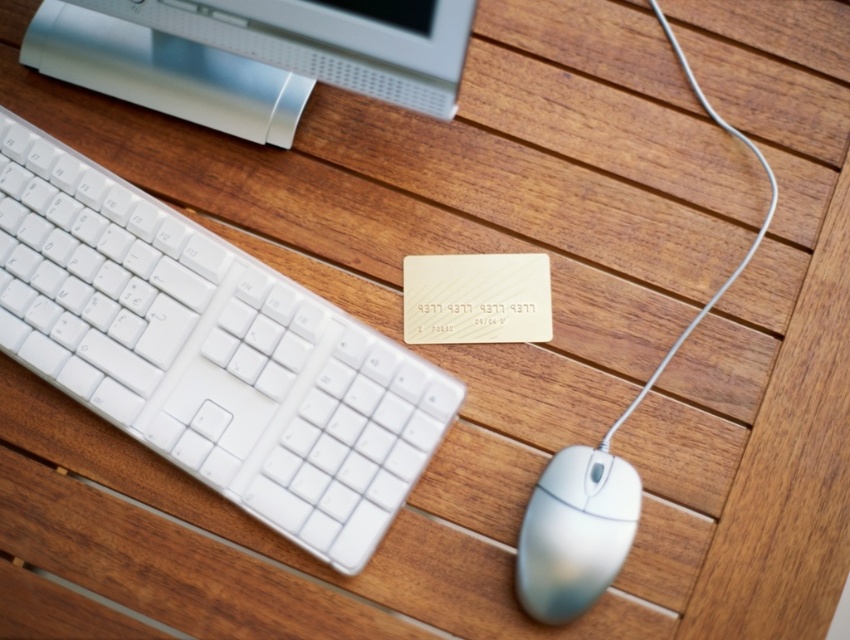
You are organizing a desk and need to place the white plastic keyboard at upper left and the white plastic mouse at lower right. Given their sizes, which one requires more desk space?

The white plastic keyboard at upper left requires more desk space because it is larger in size than the white plastic mouse at lower right.

From the picture: You are setting up a new monitor on your desk and want to place it so that it doesn not block the white plastic keyboard at upper left. Based on the coordinates provided, where should you position the monitor relative to the keyboard?

The white plastic keyboard at upper left is located at coordinates point (208, 353). To avoid blocking it, the monitor should be placed either to the right or above the keyboard, ensuring that the monitor does not overlap with the keyboard at those coordinates.

You are setting up a new desk and need to place the white plastic keyboard at upper left and the satin silver monitor at upper left. According to the image, where should you place the keyboard in relation to the monitor?

The white plastic keyboard at upper left should be placed under the satin silver monitor at upper left as shown in the image.